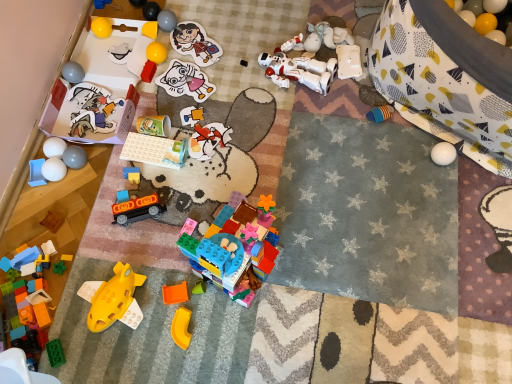
I want to click on vacant space behind matte gray ball at left, the ninth toy when ordered from left to right, so click(x=85, y=116).